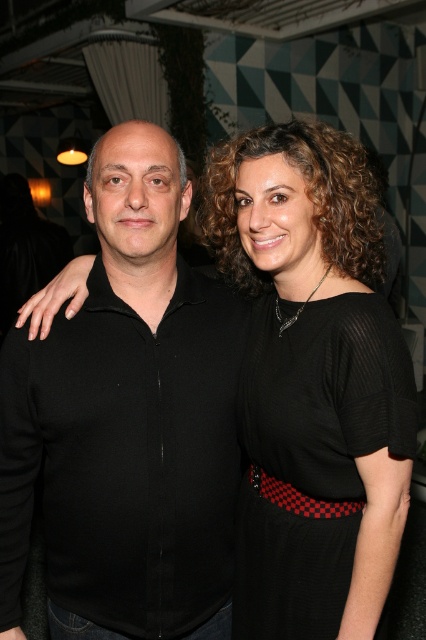
Who is positioned more to the right, black matte shirt at center or black mesh dress at center?

black mesh dress at center is more to the right.

The height and width of the screenshot is (640, 426). I want to click on black matte shirt at center, so click(x=127, y=416).

In order to click on black matte shirt at center in this screenshot , I will do `click(127, 416)`.